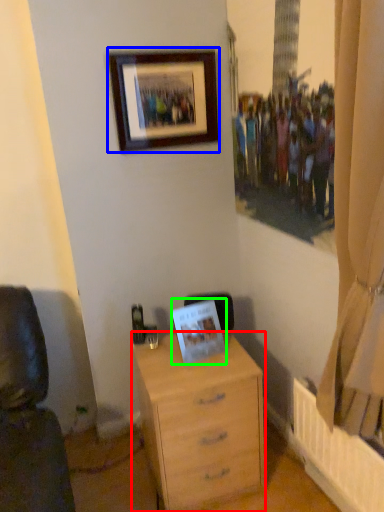
Question: Which object is positioned farthest from chest of drawers (highlighted by a red box)? Select from picture frame (highlighted by a blue box) and picture frame (highlighted by a green box).

Choices:
 (A) picture frame
 (B) picture frame

Answer: (A)